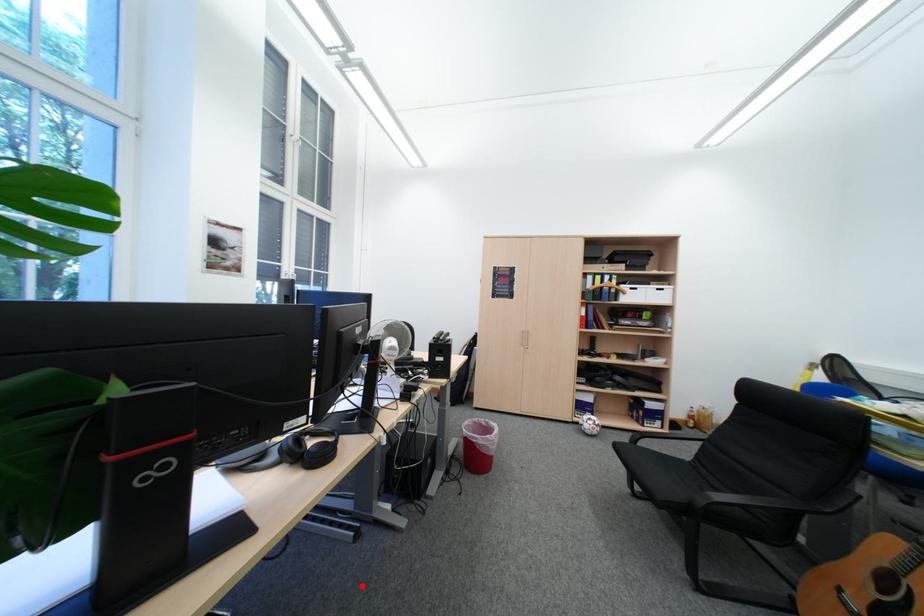
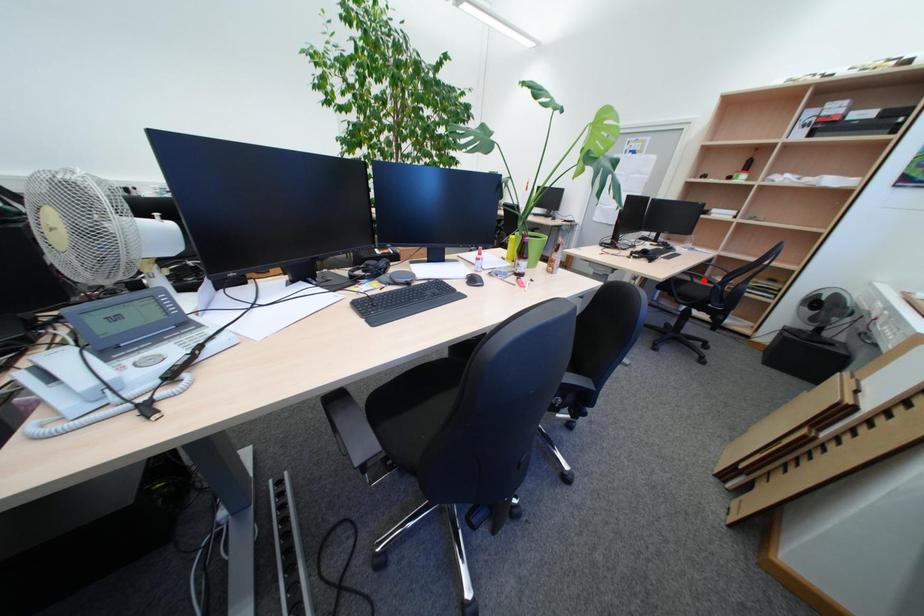
I am providing you with two images of the same scene from different viewpoints. A red point is marked on the first image and another point is marked on the second image. Is the marked point in image1 the same physical position as the marked point in image2?

No